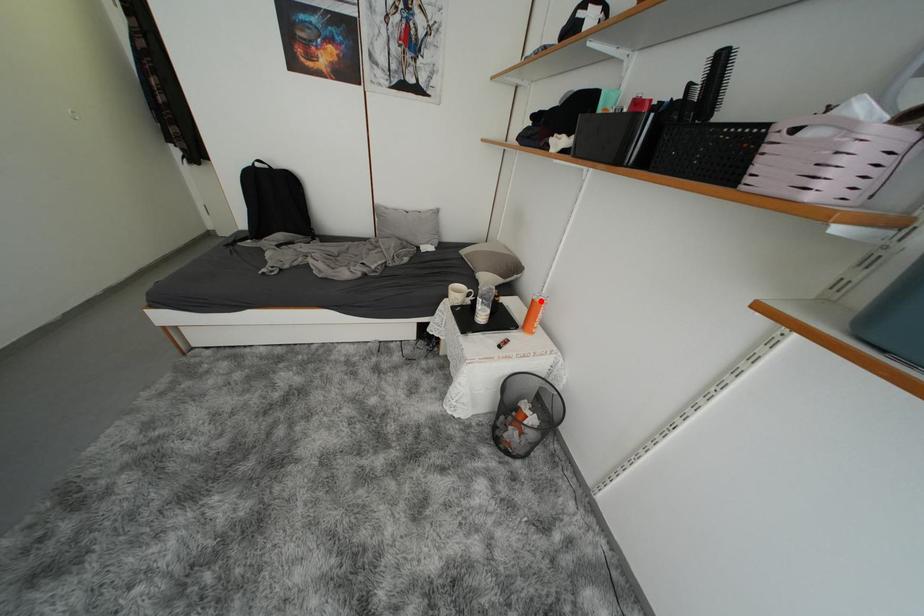
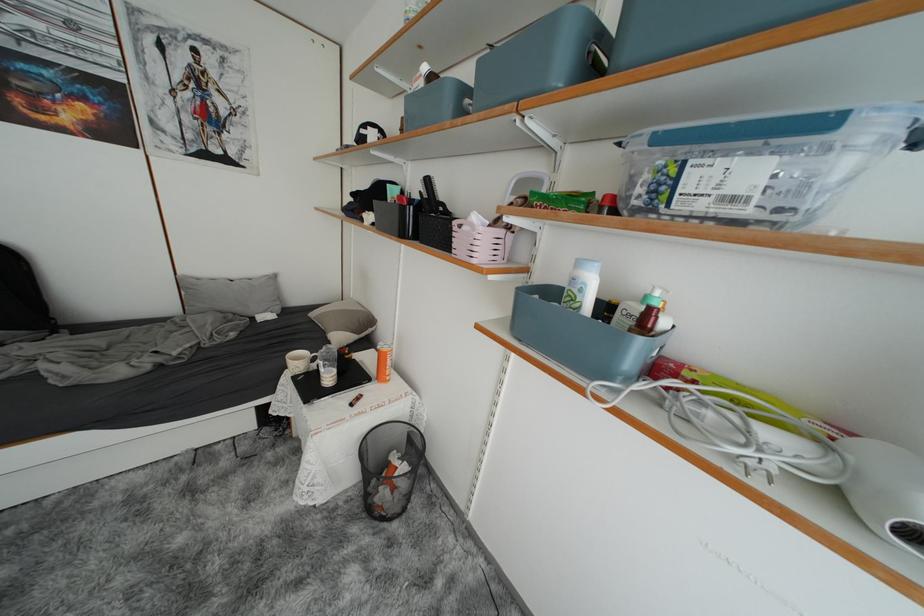
Question: A red point is marked in image1. In image2, is the corresponding 3D point closer to the camera or farther? Reply with the corresponding letter.

Choices:
 (A) The corresponding 3D point is closer.
 (B) The corresponding 3D point is farther.

Answer: (B)